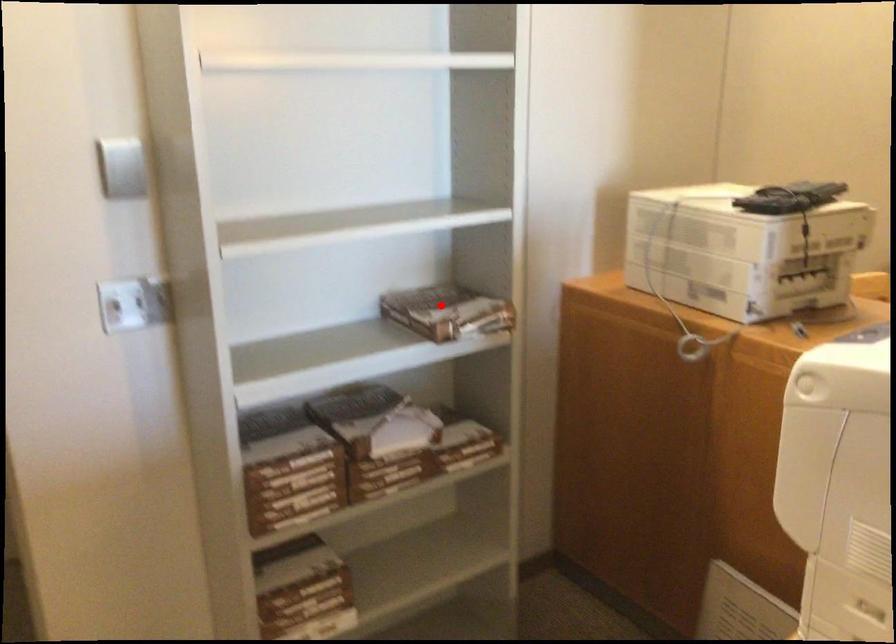
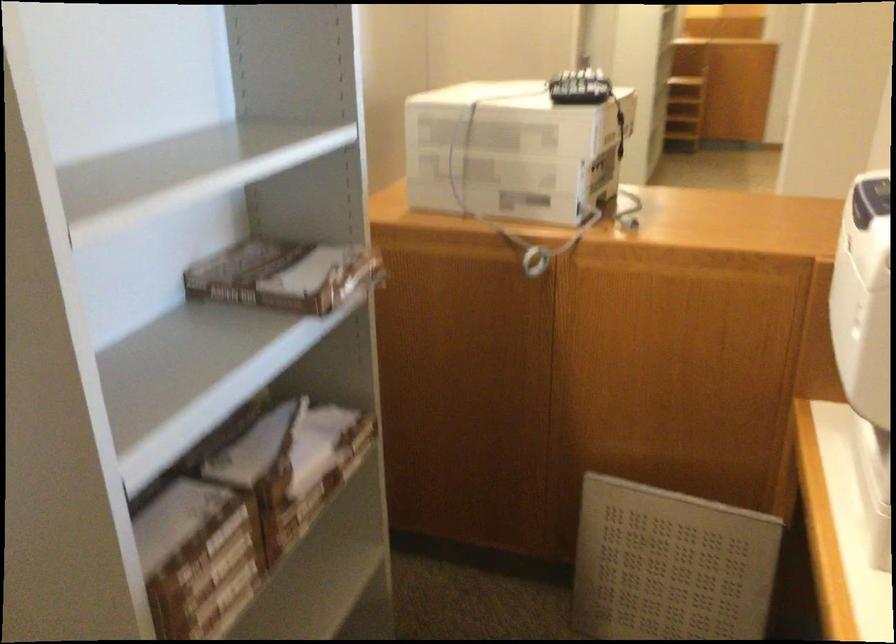
The point at the highlighted location is marked in the first image. Where is the corresponding point in the second image?

(280, 275)